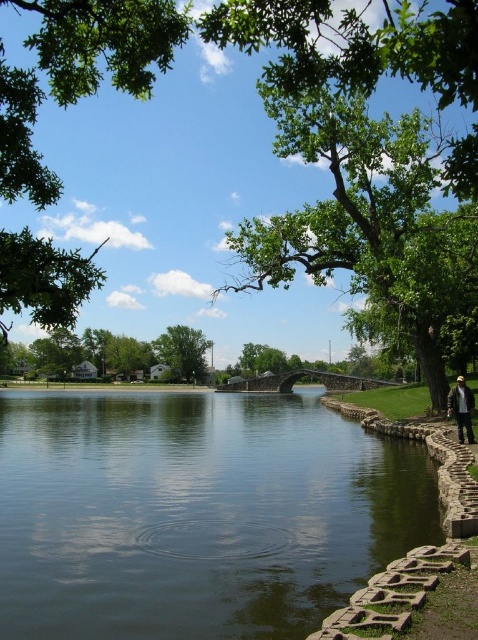
Question: Can you confirm if smooth concrete river at center is positioned above green leafy tree at center?

Choices:
 (A) no
 (B) yes

Answer: (A)

Question: Considering the real-world distances, which object is farthest from the smooth concrete river at center?

Choices:
 (A) green leafy tree at upper left
 (B) green matte tree at center
 (C) green leafy tree at center

Answer: (B)

Question: Does green leafy tree at center appear on the right side of camouflage jacket at lower right?

Choices:
 (A) yes
 (B) no

Answer: (B)

Question: Estimate the real-world distances between objects in this image. Which object is closer to the green leafy tree at upper left?

Choices:
 (A) green matte tree at center
 (B) camouflage jacket at lower right

Answer: (B)

Question: Among these objects, which one is farthest from the camera?

Choices:
 (A) green matte tree at center
 (B) green leafy tree at upper left

Answer: (A)

Question: Can you confirm if green leafy tree at center is positioned above camouflage jacket at lower right?

Choices:
 (A) no
 (B) yes

Answer: (B)